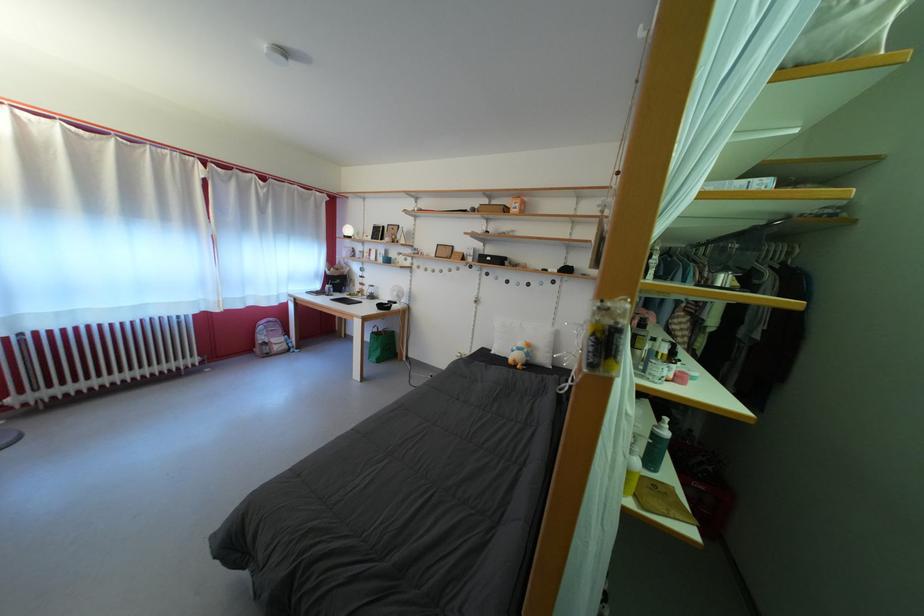
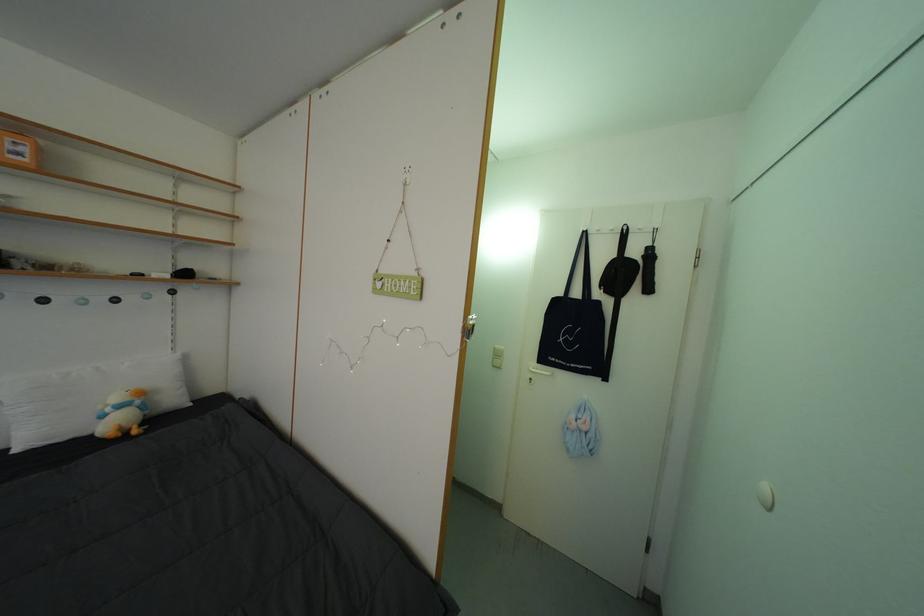
In the second image, find the point that corresponds to point (524, 354) in the first image.

(117, 415)